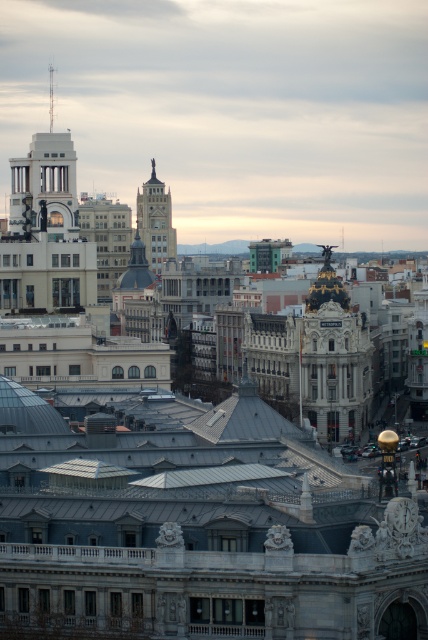
You are standing in front of the grand building and want to take a photo that includes both the matte gray tower at center and the smooth silver spire at upper left. Based on their distances from you, will both objects appear in the same frame?

The matte gray tower at center is 119.19 feet away from the smooth silver spire at upper left. Since the distance between them is 119.19 feet, whether they appear in the same frame depends on your camera lens. However, the question does not provide information about the camera lens or field of view, so it cannot be determined with the given data.

You are a city planner reviewing this area and want to install a new streetlight between the matte gray tower at center and the smooth silver spire at upper left. Based on their positions, which object should the streetlight be placed closer to?

The matte gray tower at center is below the smooth silver spire at upper left, so the streetlight should be placed closer to the matte gray tower at center since it is lower in elevation.

You are standing in front of the grand building and looking towards the city skyline. Which object is positioned to the right of the other between the matte gray tower at center and the smooth silver spire at upper left?

The matte gray tower at center is positioned to the right of the smooth silver spire at upper left.